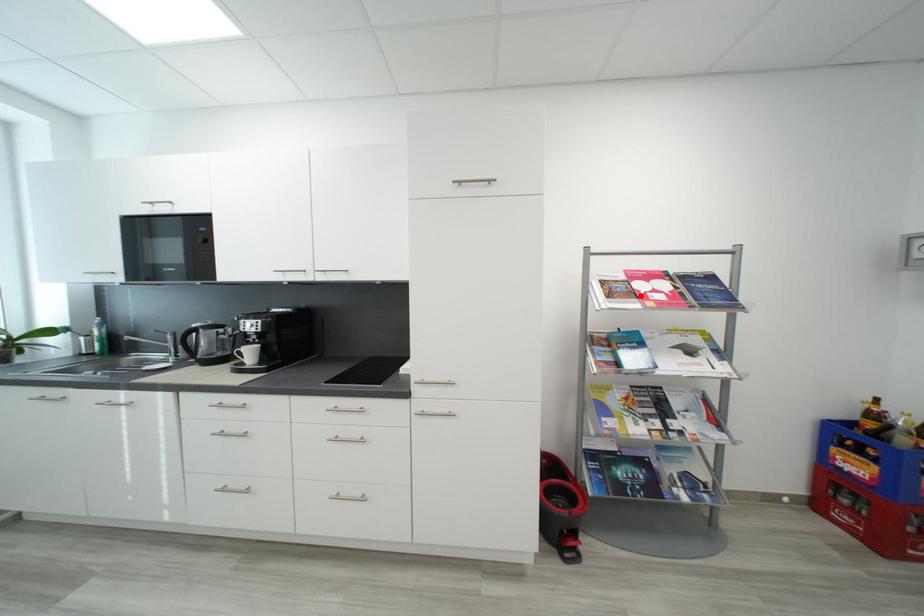
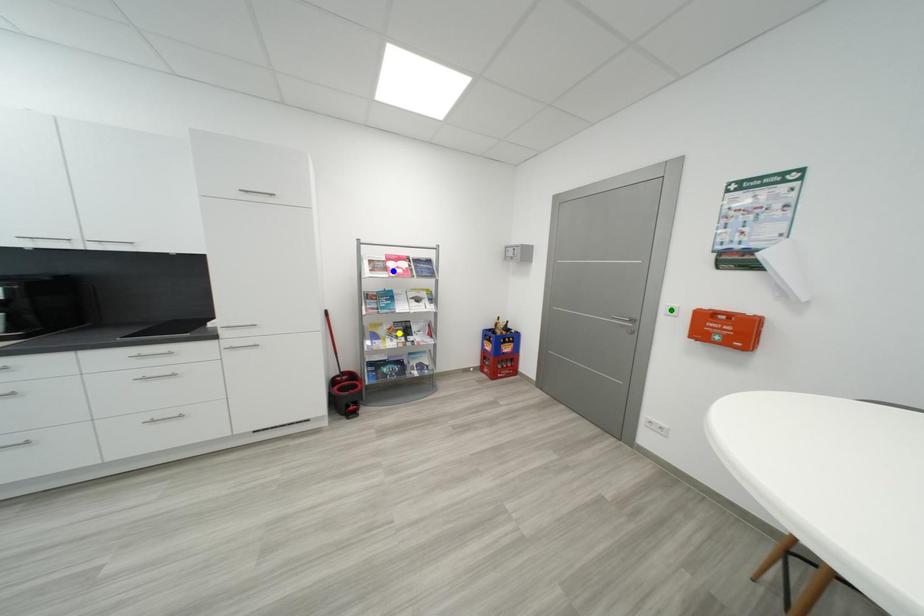
Question: I am providing you with two images of the same scene from different viewpoints. A red point is marked on the first image. You are given multiple points on the second image. Which spot in image 2 lines up with the point in image 1?

Choices:
 (A) blue point
 (B) green point
 (C) yellow point

Answer: (A)